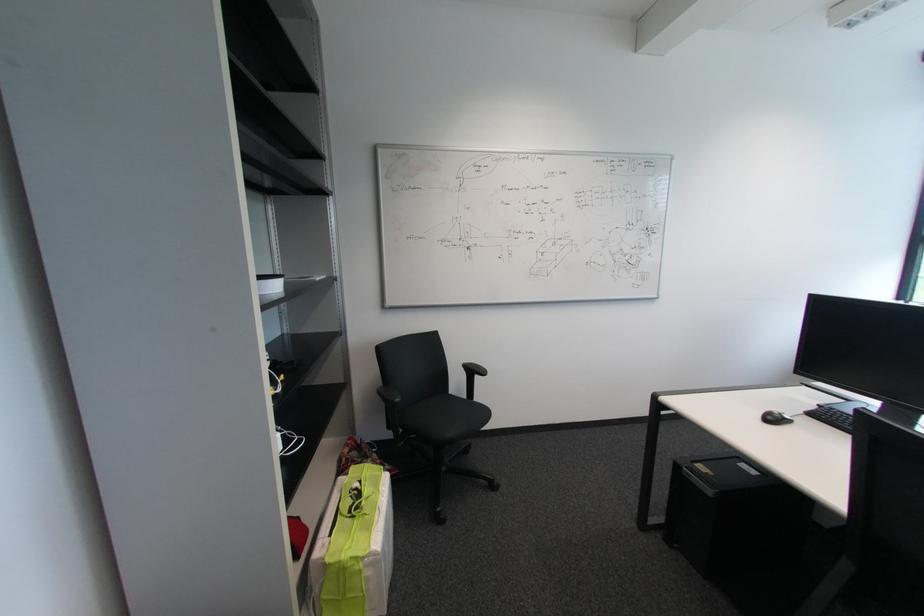
This screenshot has width=924, height=616. What are the coordinates of `black chair armrest` in the screenshot? It's located at (471, 377).